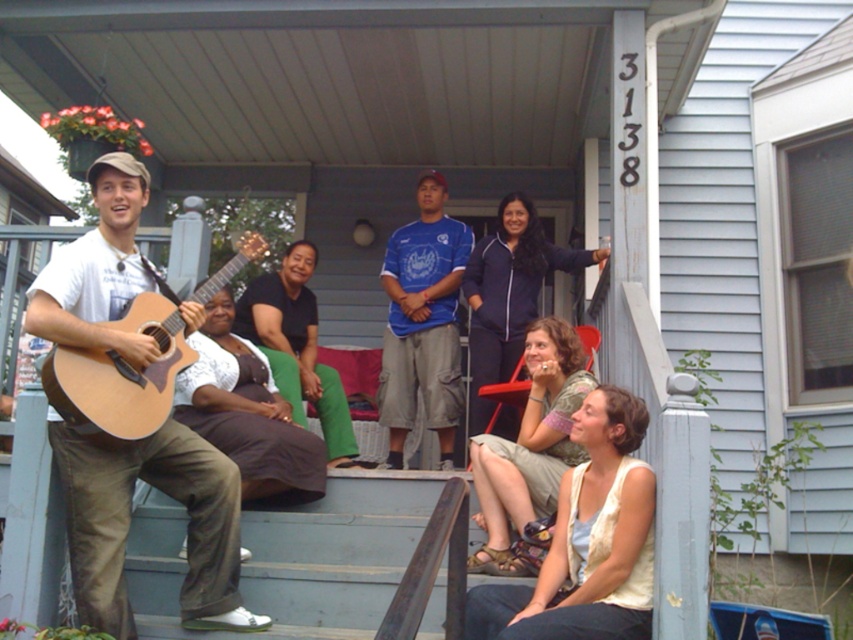
Question: Which point is closer to the camera?

Choices:
 (A) (625, 392)
 (B) (320, 388)
 (C) (140, 458)
 (D) (407, 234)

Answer: (C)

Question: Can you confirm if light beige vest at lower right is smaller than black matte shirt at center?

Choices:
 (A) no
 (B) yes

Answer: (B)

Question: Does matte brown guitar at left have a larger size compared to light beige fabric skirt at lower right?

Choices:
 (A) no
 (B) yes

Answer: (A)

Question: Considering the real-world distances, which object is farthest from the blue jersey at center?

Choices:
 (A) light brown acoustic guitar at lower left
 (B) black matte shirt at center

Answer: (A)

Question: Among these points, which one is farthest from the camera?

Choices:
 (A) tap(202, 627)
 (B) tap(392, 589)

Answer: (B)

Question: Does wooden porch at center have a lesser width compared to light beige fabric skirt at lower right?

Choices:
 (A) yes
 (B) no

Answer: (B)